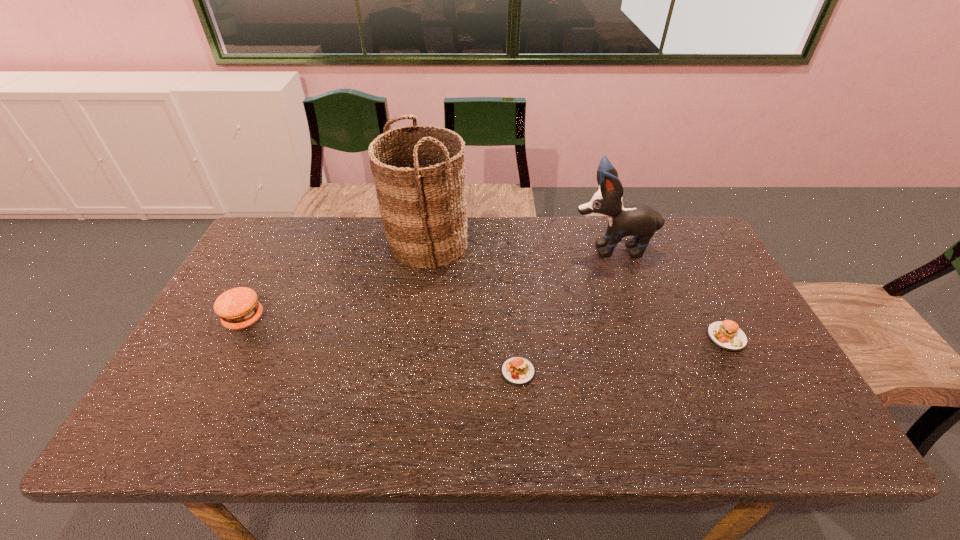
Image resolution: width=960 pixels, height=540 pixels. Find the location of `vacant space situated 0.160m on the right of the basket`. vacant space situated 0.160m on the right of the basket is located at coordinates (517, 244).

Identify the location of vacant area situated on the front-facing side of the second tallest object. (517, 248).

The image size is (960, 540). Identify the location of vacant space located on the front-facing side of the second tallest object. (520, 248).

You are a GUI agent. You are given a task and a screenshot of the screen. Output one action in this format:
    pyautogui.click(x=<x>, y=<y>)
    Task: Click on the blank area located 0.070m on the front-facing side of the second tallest object
    This screenshot has height=540, width=960.
    Given the screenshot: What is the action you would take?
    pyautogui.click(x=548, y=248)

Identify the location of free spot located on the front of the leftmost object. This screenshot has width=960, height=540. (204, 397).

Where is `vacant space located 0.320m on the back of the rightmost patty (food)`? vacant space located 0.320m on the back of the rightmost patty (food) is located at coordinates (680, 247).

Locate an element on the screen. free spot located 0.200m on the back of the nearest object is located at coordinates (513, 300).

What are the coordinates of `basket that is at the far edge` in the screenshot? It's located at (422, 206).

Image resolution: width=960 pixels, height=540 pixels. I want to click on puppy positioned at the far edge, so click(639, 220).

The image size is (960, 540). I want to click on object present at the left edge, so click(x=238, y=308).